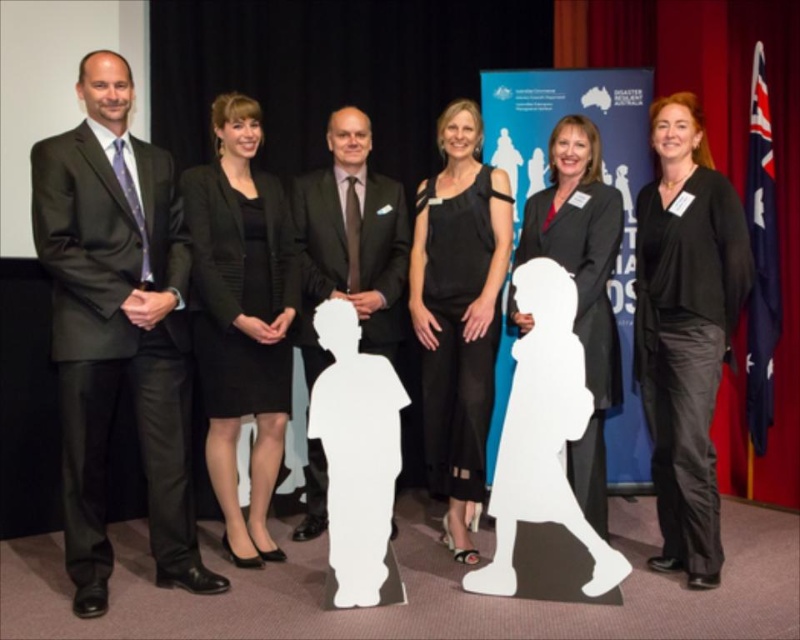
You are a photographer who needs to adjust the lighting to ensure all participants are evenly lit. Given that the matte black suit at left is wider than the matte black suit at center, which participant might require more light to ensure their suit doesn

The matte black suit at left is wider than the matte black suit at center, so it might require more light to ensure proper exposure since wider surfaces can absorb more light and appear darker in photographs.